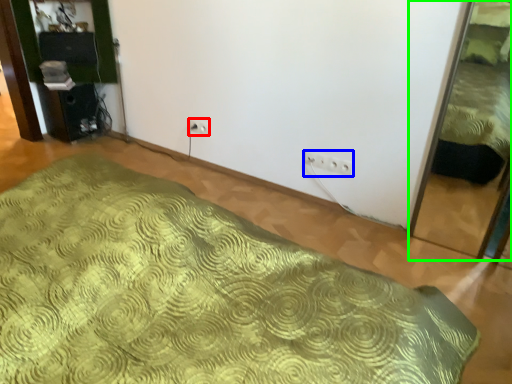
Question: Based on their relative distances, which object is farther from electric outlet (highlighted by a red box)? Choose from electric outlet (highlighted by a blue box) and bed (highlighted by a green box).

Choices:
 (A) electric outlet
 (B) bed

Answer: (B)